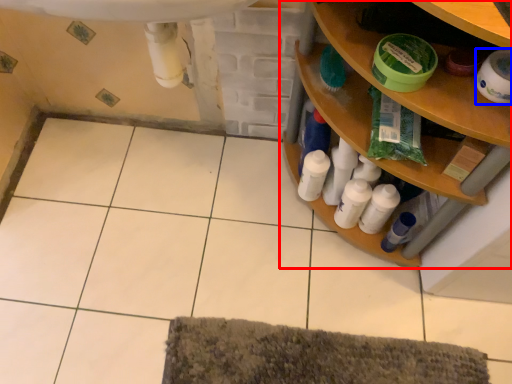
Question: Among these objects, which one is nearest to the camera, shelf (highlighted by a red box) or toilet paper (highlighted by a blue box)?

Choices:
 (A) shelf
 (B) toilet paper

Answer: (A)